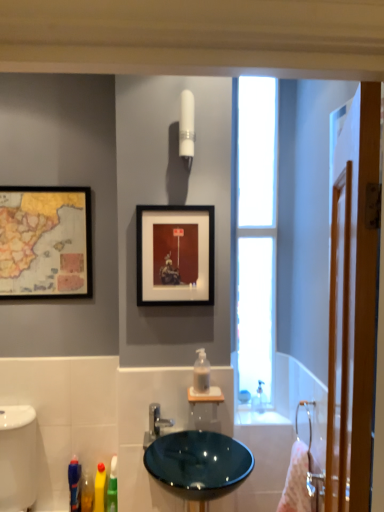
Question: Does transparent glass window at right have a lesser height compared to satin nickel faucet at center?

Choices:
 (A) yes
 (B) no

Answer: (B)

Question: Considering the relative sizes of transparent glass window at right and satin nickel faucet at center in the image provided, is transparent glass window at right taller than satin nickel faucet at center?

Choices:
 (A) no
 (B) yes

Answer: (B)

Question: From the image's perspective, is transparent glass window at right beneath satin nickel faucet at center?

Choices:
 (A) no
 (B) yes

Answer: (A)

Question: From the image's perspective, is transparent glass window at right above satin nickel faucet at center?

Choices:
 (A) yes
 (B) no

Answer: (A)

Question: From a real-world perspective, is transparent glass window at right physically above satin nickel faucet at center?

Choices:
 (A) no
 (B) yes

Answer: (B)

Question: Choose the correct answer: Is black matte picture frame at upper center, which appears as the 2th picture frame when viewed from the left, inside translucent plastic soap dispenser at center or outside it?

Choices:
 (A) inside
 (B) outside

Answer: (B)

Question: Looking at their shapes, would you say black matte picture frame at upper center, the first picture frame viewed from the front, is wider or thinner than translucent plastic soap dispenser at center?

Choices:
 (A) wide
 (B) thin

Answer: (B)

Question: Considering the positions of point (173, 219) and point (200, 354), is point (173, 219) closer or farther from the camera than point (200, 354)?

Choices:
 (A) farther
 (B) closer

Answer: (B)

Question: Relative to translucent plastic soap dispenser at center, is black matte picture frame at upper center, the 2th picture frame when ordered from back to front, in front or behind?

Choices:
 (A) behind
 (B) front

Answer: (A)

Question: Is wooden-framed map at upper left, which is the 1th picture frame from left to right, inside the boundaries of satin nickel faucet at center, or outside?

Choices:
 (A) outside
 (B) inside

Answer: (A)

Question: From a real-world perspective, is wooden-framed map at upper left, arranged as the second picture frame when viewed from the front, positioned above or below satin nickel faucet at center?

Choices:
 (A) above
 (B) below

Answer: (A)

Question: From their relative heights in the image, would you say wooden-framed map at upper left, which is the 1th picture frame from left to right, is taller or shorter than satin nickel faucet at center?

Choices:
 (A) short
 (B) tall

Answer: (B)

Question: Considering the positions of point (6, 249) and point (173, 421), is point (6, 249) closer or farther from the camera than point (173, 421)?

Choices:
 (A) farther
 (B) closer

Answer: (A)

Question: From their relative heights in the image, would you say pink fabric towel at right is taller or shorter than wooden screen door at right?

Choices:
 (A) short
 (B) tall

Answer: (A)

Question: Relative to wooden screen door at right, is pink fabric towel at right in front or behind?

Choices:
 (A) behind
 (B) front

Answer: (A)